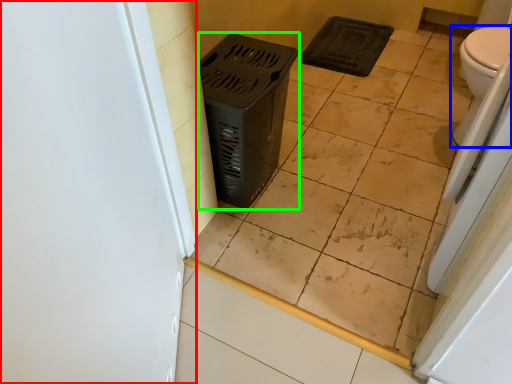
Question: Which object is positioned closest to screen door (highlighted by a red box)? Select from toilet (highlighted by a blue box) and laundry basket (highlighted by a green box).

Choices:
 (A) toilet
 (B) laundry basket

Answer: (B)